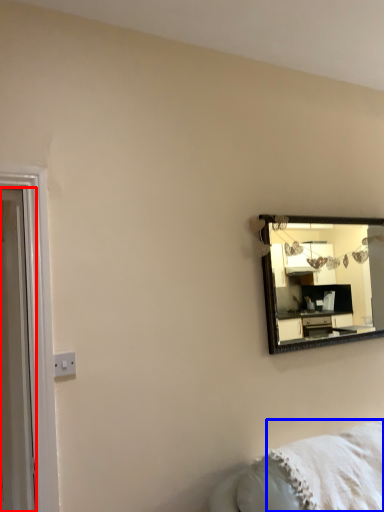
Question: Among these objects, which one is nearest to the camera, door (highlighted by a red box) or blanket (highlighted by a blue box)?

Choices:
 (A) door
 (B) blanket

Answer: (A)